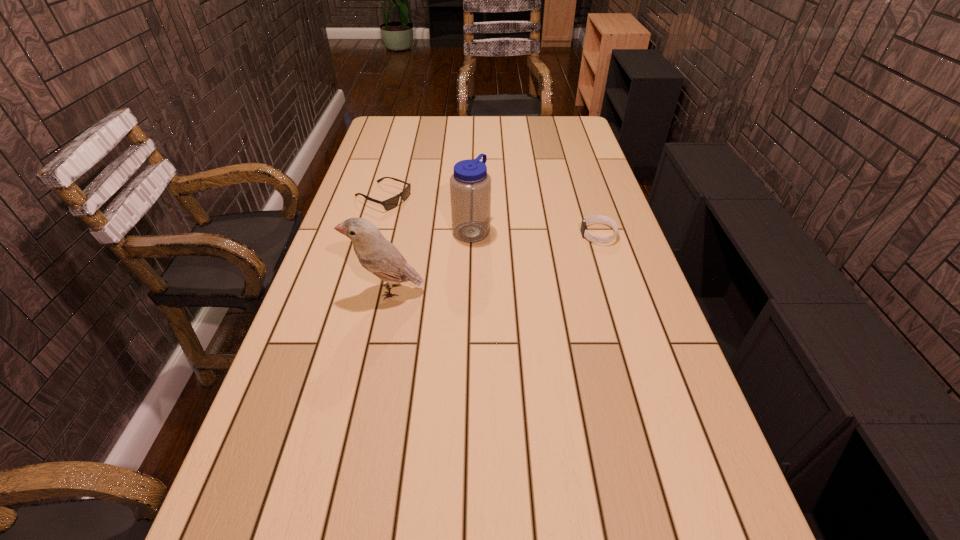
In the image, there is a desktop. At what (x,y) coordinates should I click in order to perform the action: click on free space at the left edge. Please return your answer as a coordinate pair (x, y). Image resolution: width=960 pixels, height=540 pixels. Looking at the image, I should click on (349, 246).

Identify the location of free space at the right edge of the desktop. This screenshot has height=540, width=960. (643, 283).

In order to click on free space at the far left corner in this screenshot , I will do `click(399, 136)`.

At what (x,y) coordinates should I click in order to perform the action: click on empty space between the second object from right to left and the farthest object. Please return your answer as a coordinate pair (x, y). The width and height of the screenshot is (960, 540). Looking at the image, I should click on (427, 214).

This screenshot has height=540, width=960. I want to click on vacant point located between the water bottle and the nearest object, so click(429, 260).

Where is `vacant region between the wristband and the third object from left to right`? vacant region between the wristband and the third object from left to right is located at coordinates (535, 232).

Where is `unoccupied area between the wristband and the bird`? unoccupied area between the wristband and the bird is located at coordinates (493, 262).

At what (x,y) coordinates should I click in order to perform the action: click on empty location between the second object from right to left and the sunglasses. Please return your answer as a coordinate pair (x, y). Looking at the image, I should click on (427, 214).

Find the location of a particular element. free space between the farthest object and the water bottle is located at coordinates (427, 214).

You are a GUI agent. You are given a task and a screenshot of the screen. Output one action in this format:
    pyautogui.click(x=<x>, y=<y>)
    Task: Click on the free area in between the sunglasses and the third object from left to right
    The image size is (960, 540).
    Given the screenshot: What is the action you would take?
    pyautogui.click(x=427, y=214)